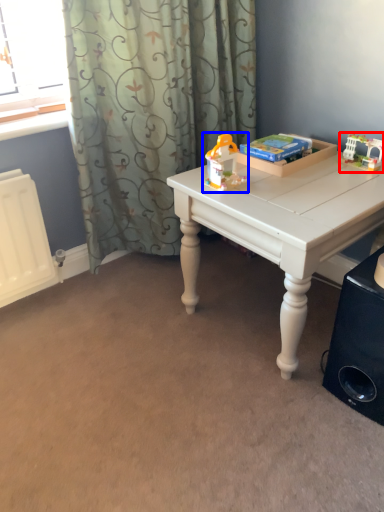
Question: Which of the following is the farthest to the observer, toy (highlighted by a red box) or toy (highlighted by a blue box)?

Choices:
 (A) toy
 (B) toy

Answer: (A)